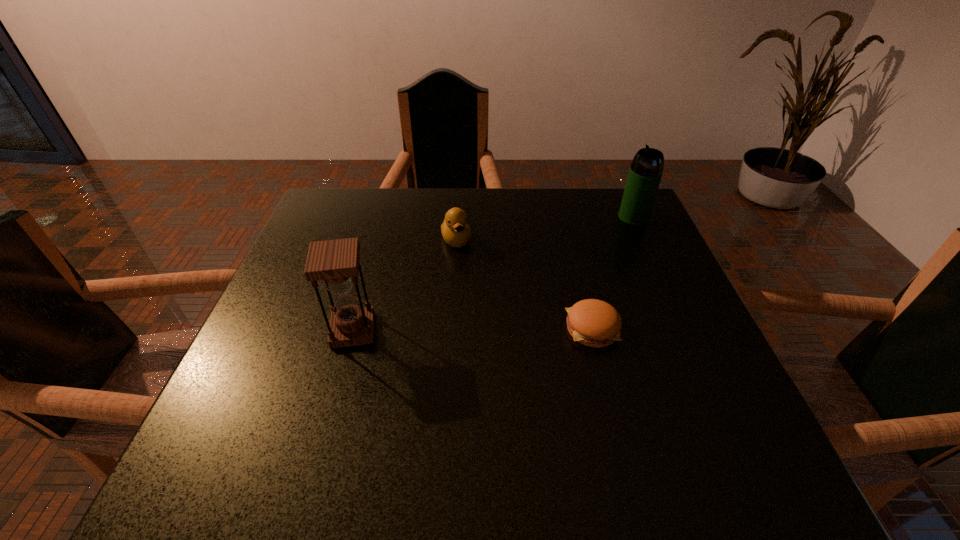
Find the location of a particular element. The width and height of the screenshot is (960, 540). free space located from the spout of the farthest object is located at coordinates (591, 250).

Find the location of a particular element. vacant area situated 0.160m from the spout of the farthest object is located at coordinates (591, 250).

The image size is (960, 540). Identify the location of vacant space located on the face of the second farthest object. (484, 327).

Where is `blank space located on the face of the second farthest object`? The height and width of the screenshot is (540, 960). blank space located on the face of the second farthest object is located at coordinates (504, 386).

What are the coordinates of `free space located 0.230m on the face of the second farthest object` in the screenshot? It's located at (482, 320).

Find the location of a particular element. Image resolution: width=960 pixels, height=540 pixels. thermos bottle located in the far edge section of the desktop is located at coordinates (646, 169).

You are a GUI agent. You are given a task and a screenshot of the screen. Output one action in this format:
    pyautogui.click(x=<x>, y=<y>)
    Task: Click on the duckling at the far edge
    The width and height of the screenshot is (960, 540).
    Given the screenshot: What is the action you would take?
    pyautogui.click(x=455, y=230)

What are the coordinates of `object present at the left edge` in the screenshot? It's located at (336, 262).

You are a GUI agent. You are given a task and a screenshot of the screen. Output one action in this format:
    pyautogui.click(x=<x>, y=<y>)
    Task: Click on the object located at the right edge
    This screenshot has height=540, width=960.
    Given the screenshot: What is the action you would take?
    pyautogui.click(x=646, y=169)

This screenshot has height=540, width=960. Find the location of `object at the far right corner`. object at the far right corner is located at coordinates (646, 169).